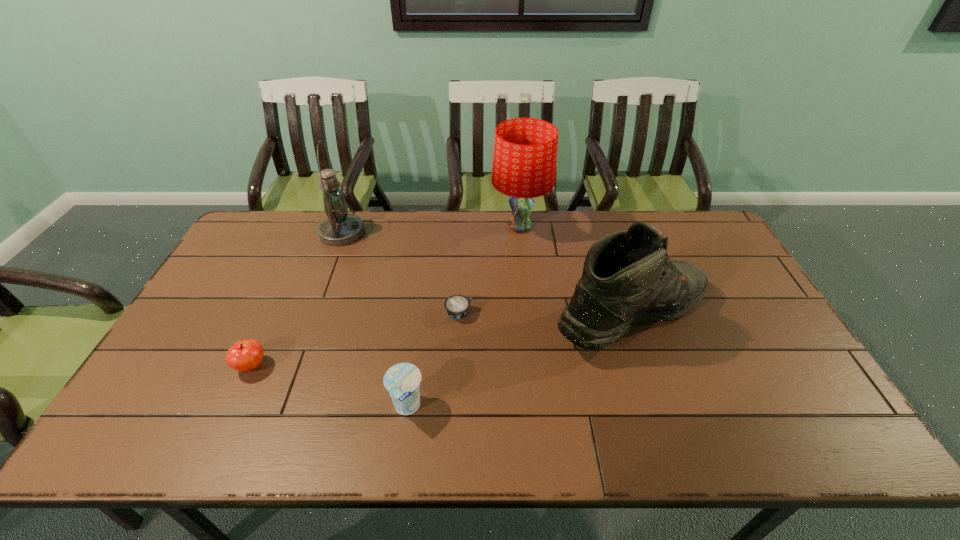
Image resolution: width=960 pixels, height=540 pixels. What are the coordinates of `vacant area that lies between the ski boot and the shortest object` in the screenshot? It's located at (545, 315).

Image resolution: width=960 pixels, height=540 pixels. Find the location of `free area in between the lampshade and the right yogurt`. free area in between the lampshade and the right yogurt is located at coordinates (490, 270).

In order to click on blank region between the nearer yogurt and the ski boot in this screenshot , I will do `click(519, 362)`.

The height and width of the screenshot is (540, 960). Find the location of `free space between the nearer yogurt and the shorter yogurt`. free space between the nearer yogurt and the shorter yogurt is located at coordinates (433, 360).

Choose which object is the nearest neighbor to the fourth tallest object. Please provide its 2D coordinates. Your answer should be formatted as a tuple, i.e. [(x, y)], where the tuple contains the x and y coordinates of a point satisfying the conditions above.

[(457, 306)]

Locate an element on the screen. The image size is (960, 540). the second closest object to the fourth tallest object is located at coordinates (245, 355).

Locate an element on the screen. The width and height of the screenshot is (960, 540). free location that satisfies the following two spatial constraints: 1. on the front-facing side of the lampshade; 2. on the left side of the ski boot is located at coordinates (530, 316).

Image resolution: width=960 pixels, height=540 pixels. Find the location of `vacant space that satisfies the following two spatial constraints: 1. on the front side of the nearer yogurt; 2. on the right side of the second shortest object`. vacant space that satisfies the following two spatial constraints: 1. on the front side of the nearer yogurt; 2. on the right side of the second shortest object is located at coordinates (232, 407).

Locate an element on the screen. This screenshot has width=960, height=540. vacant space that satisfies the following two spatial constraints: 1. on the front-facing side of the lampshade; 2. on the left side of the ski boot is located at coordinates (530, 316).